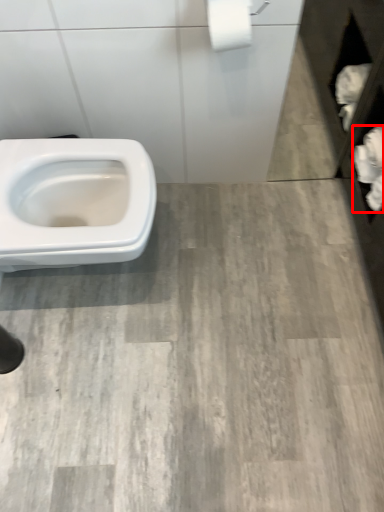
Question: From the image's perspective, where is toilet paper (annotated by the red box) located relative to toilet paper?

Choices:
 (A) above
 (B) below

Answer: (B)